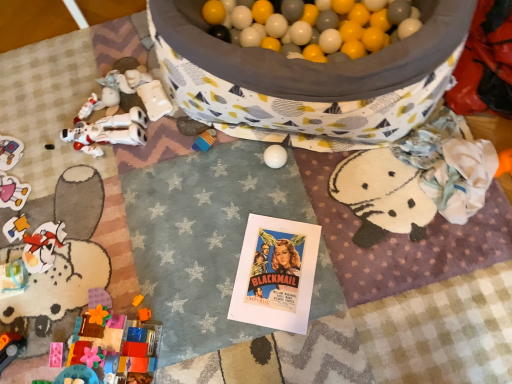
You are a GUI agent. You are given a task and a screenshot of the screen. Output one action in this format:
    pyautogui.click(x=<x>, y=<y>)
    Task: Click on the vacant area that is situated to the right of white matte robot at left, the third toy positioned from the front
    
    Given the screenshot: What is the action you would take?
    pyautogui.click(x=174, y=134)